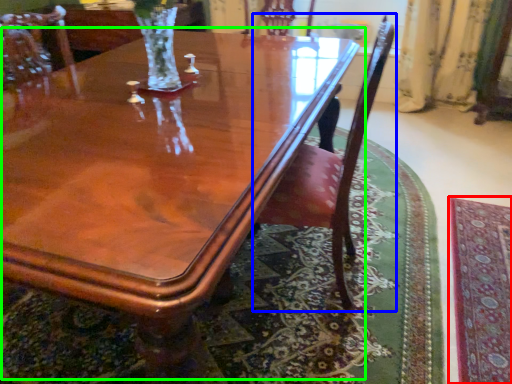
Question: Considering the real-world distances, which object is farthest from mat (highlighted by a red box)? chair (highlighted by a blue box) or coffee table (highlighted by a green box)?

Choices:
 (A) chair
 (B) coffee table

Answer: (B)